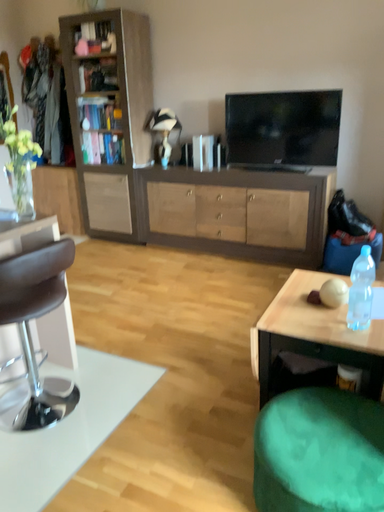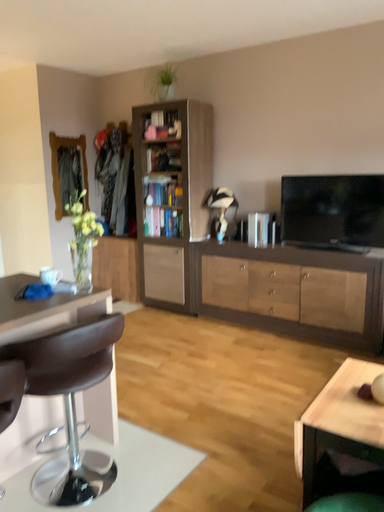
Question: Which way did the camera rotate in the video?

Choices:
 (A) rotated downward
 (B) rotated upward

Answer: (B)